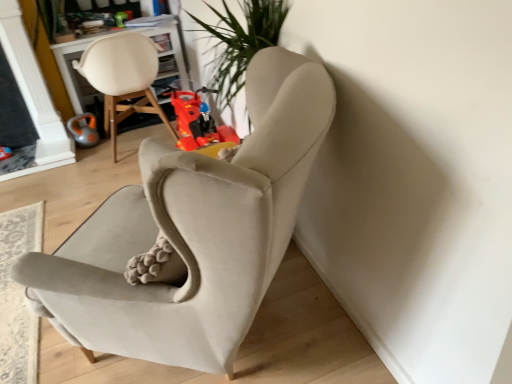
This screenshot has height=384, width=512. What are the coordinates of `vacant space in front of orange rubber toy at left, marked as the first toy in a left-to-right arrangement` in the screenshot? It's located at (92, 153).